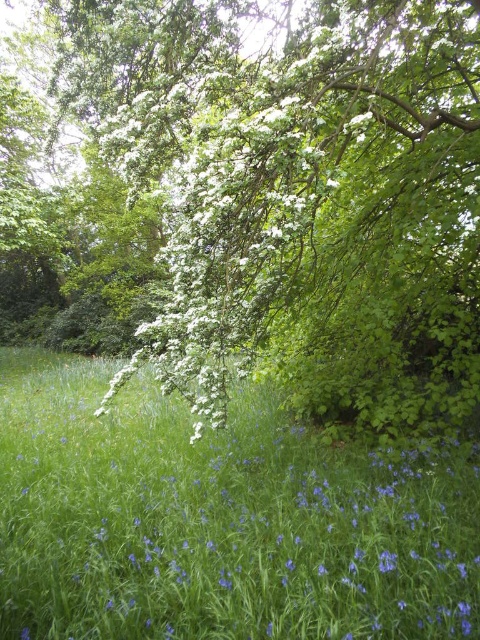
Question: Is green leafy tree at upper center positioned behind white matte flower at center?

Choices:
 (A) no
 (B) yes

Answer: (B)

Question: Among these objects, which one is farthest from the camera?

Choices:
 (A) green leafy tree at upper center
 (B) white matte flower at center

Answer: (A)

Question: Is green leafy tree at upper center smaller than white matte flower at center?

Choices:
 (A) no
 (B) yes

Answer: (A)

Question: Which object appears farthest from the camera in this image?

Choices:
 (A) white matte flower at center
 (B) green leafy tree at upper center

Answer: (B)

Question: Can you confirm if green leafy tree at upper center is wider than white matte flower at center?

Choices:
 (A) yes
 (B) no

Answer: (A)

Question: Which of the following is the closest to the observer?

Choices:
 (A) white matte flower at center
 (B) green leafy tree at upper center

Answer: (A)